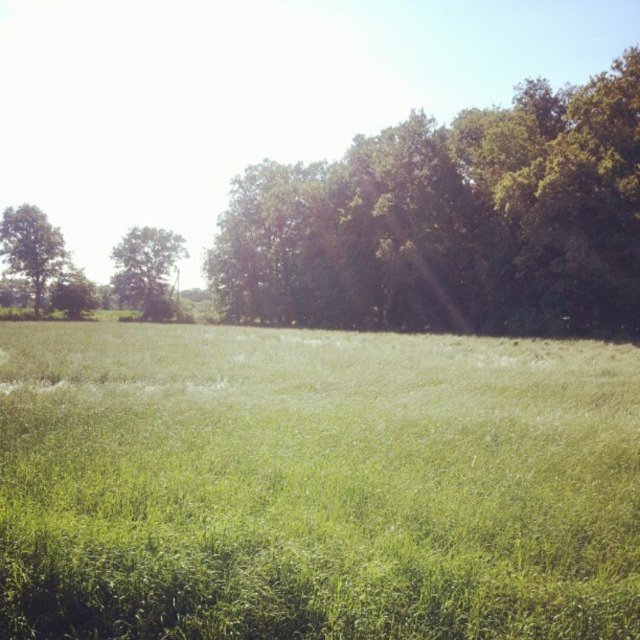
You are standing in the middle of the green grass and looking towards the line of trees. Which tree, the green leafy tree at upper right or the green leafy tree at left, is positioned higher in the image?

The green leafy tree at upper right is positioned higher in the image than the green leafy tree at left.